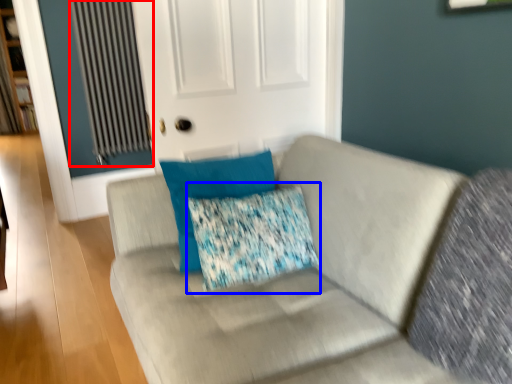
Question: Which point is further to the camera, radiator (highlighted by a red box) or throw pillow (highlighted by a blue box)?

Choices:
 (A) radiator
 (B) throw pillow

Answer: (A)